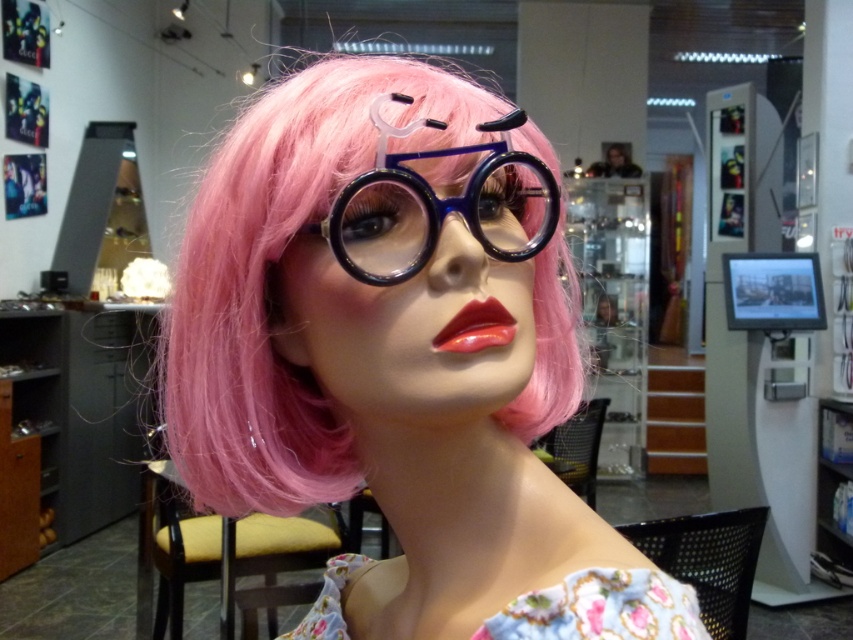
Locate an element on the screen. This screenshot has width=853, height=640. translucent plastic glasses at center is located at coordinates (398, 358).

Identify the location of blue plastic goggles at center. (438, 202).

Between blue plastic goggles at center and glossy red lips at center, which one appears on the left side from the viewer's perspective?

blue plastic goggles at center

Who is more forward, (508, 204) or (502, 332)?

Point (502, 332) is more forward.

At what (x,y) coordinates should I click in order to perform the action: click on blue plastic goggles at center. Please return your answer as a coordinate pair (x, y). The image size is (853, 640). Looking at the image, I should click on (438, 202).

Which is in front, point (183, 397) or point (448, 198)?

Point (448, 198) is in front.

Does translucent plastic glasses at center have a greater width compared to blue plastic goggles at center?

Yes.

Is point (503, 483) farther from viewer compared to point (387, 209)?

Yes, point (503, 483) is behind point (387, 209).

At what (x,y) coordinates should I click in order to perform the action: click on translucent plastic glasses at center. Please return your answer as a coordinate pair (x, y). Looking at the image, I should click on (398, 358).